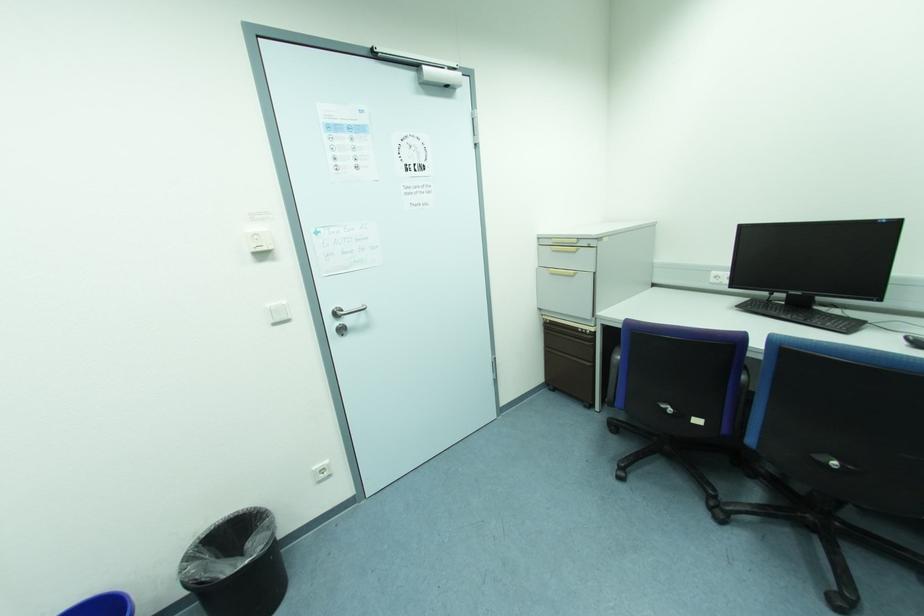
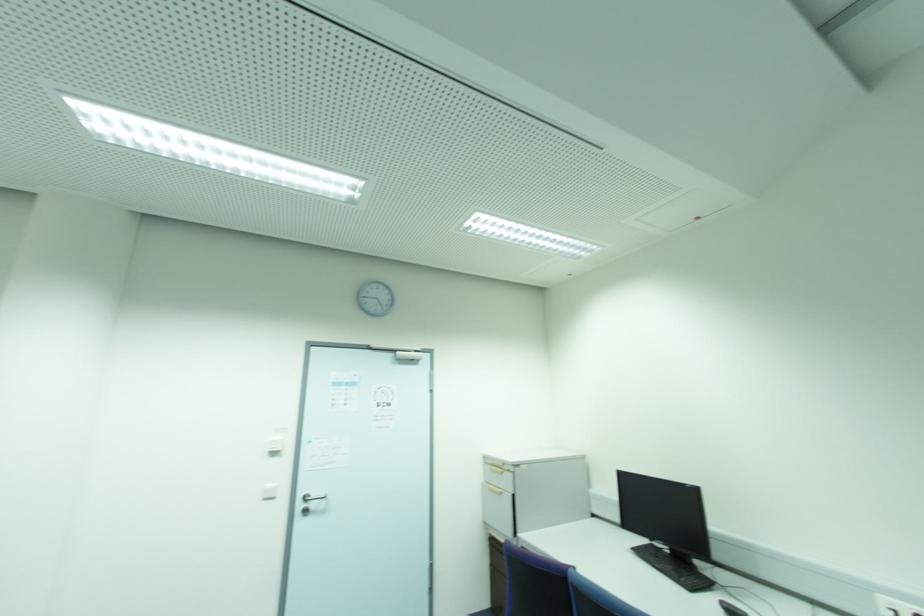
The point at (285, 302) is marked in the first image. Where is the corresponding point in the second image?

(274, 485)